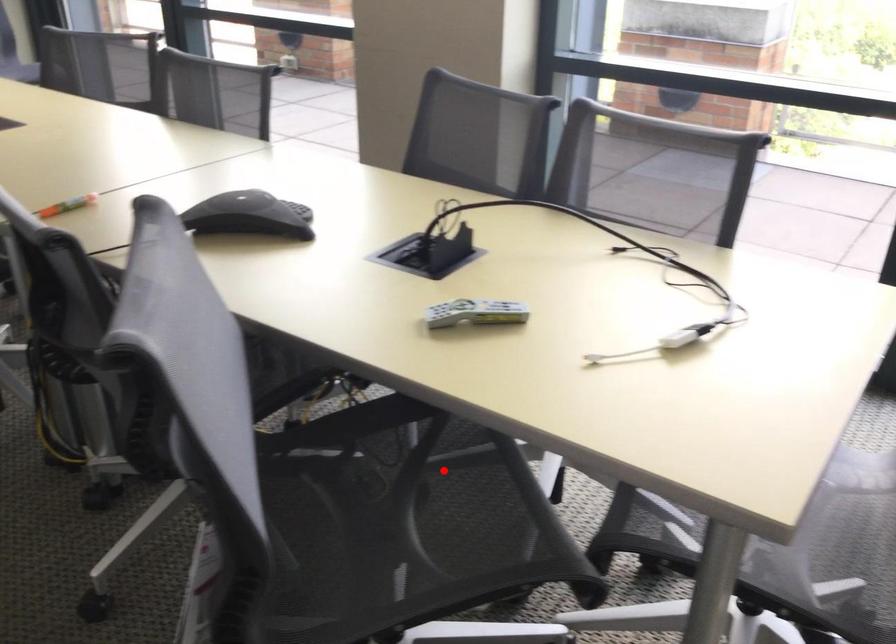
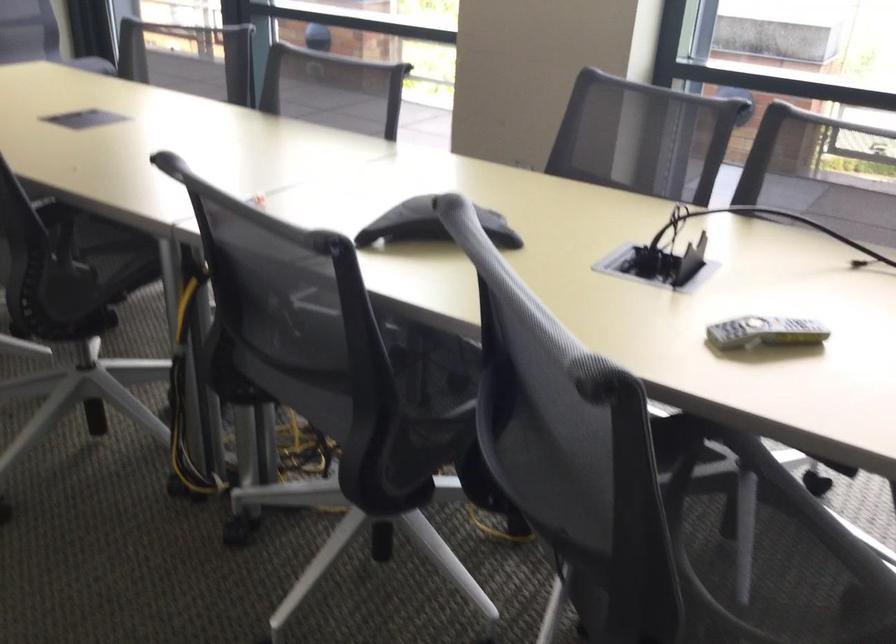
Question: I am providing you with two images of the same scene from different viewpoints. A red point is marked on the first image. At the location where the point appears in image 1, is it still visible in image 2?

Choices:
 (A) Yes
 (B) No

Answer: (A)